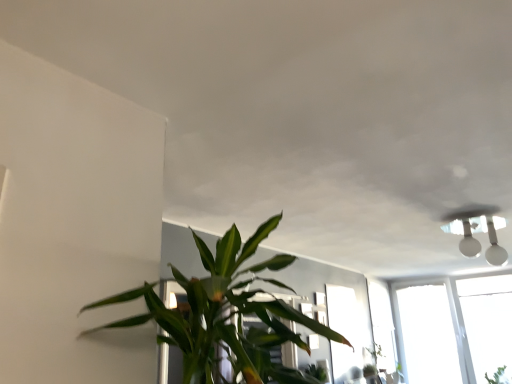
What is the approximate width of green leafy plant at center?

30.66 inches.

Where is `transparent glass window at center`? transparent glass window at center is located at coordinates (347, 335).

What do you see at coordinates (347, 335) in the screenshot? I see `transparent glass window at center` at bounding box center [347, 335].

The height and width of the screenshot is (384, 512). What are the coordinates of `green leafy plant at lower right` in the screenshot? It's located at (497, 376).

The image size is (512, 384). Identify the location of green leafy plant at center. (225, 315).

Between green leafy plant at lower right and green leafy plant at center, which one has less height?

Standing shorter between the two is green leafy plant at lower right.

Considering the sizes of green leafy plant at lower right and green leafy plant at center in the image, is green leafy plant at lower right wider or thinner than green leafy plant at center?

Considering their sizes, green leafy plant at lower right looks slimmer than green leafy plant at center.

Is green leafy plant at center surrounded by green leafy plant at lower right?

No, green leafy plant at center is not a part of green leafy plant at lower right.

Is point (501, 379) less distant than point (185, 344)?

No.

Considering the relative positions of green leafy plant at lower right and transparent glass window at center in the image provided, is green leafy plant at lower right to the left of transparent glass window at center from the viewer's perspective?

No.

Consider the image. Is green leafy plant at lower right taller or shorter than transparent glass window at center?

Clearly, green leafy plant at lower right is shorter compared to transparent glass window at center.

Are green leafy plant at lower right and transparent glass window at center beside each other?

green leafy plant at lower right and transparent glass window at center are not in contact.

Between transparent glass window at center and green leafy plant at center, which one has smaller width?

transparent glass window at center.

What's the angular difference between transparent glass window at center and green leafy plant at center's facing directions?

The facing directions of transparent glass window at center and green leafy plant at center are 91.1 degrees apart.

How far apart are transparent glass window at center and green leafy plant at center?

transparent glass window at center is 3.19 meters away from green leafy plant at center.

From a real-world perspective, is transparent glass window at center physically located above or below green leafy plant at center?

Clearly, from a real-world perspective, transparent glass window at center is below green leafy plant at center.

What's the angular difference between green leafy plant at center and transparent glass window at center's facing directions?

The angle between the facing direction of green leafy plant at center and the facing direction of transparent glass window at center is 91.1 degrees.

Does green leafy plant at center come in front of transparent glass window at center?

Yes, green leafy plant at center is closer to the camera.

Can you confirm if green leafy plant at center is smaller than transparent glass window at center?

No, green leafy plant at center is not smaller than transparent glass window at center.

Considering the points (246, 291) and (344, 316), which point is in front, point (246, 291) or point (344, 316)?

The point (246, 291) is closer to the camera.

From the image's perspective, does green leafy plant at center appear lower than green leafy plant at lower right?

No.

From a real-world perspective, is green leafy plant at center positioned above or below green leafy plant at lower right?

green leafy plant at center is above green leafy plant at lower right.

From their relative heights in the image, would you say green leafy plant at center is taller or shorter than green leafy plant at lower right?

Considering their sizes, green leafy plant at center has more height than green leafy plant at lower right.

Which of these two, green leafy plant at center or green leafy plant at lower right, is bigger?

green leafy plant at center is bigger.

How different are the orientations of transparent glass window at center and green leafy plant at lower right in degrees?

The angle between the facing direction of transparent glass window at center and the facing direction of green leafy plant at lower right is 85 degrees.

Does transparent glass window at center have a lesser height compared to green leafy plant at lower right?

No, transparent glass window at center is not shorter than green leafy plant at lower right.

Between transparent glass window at center and green leafy plant at lower right, which one has larger size?

A: green leafy plant at lower right is bigger.

Locate an element on the screen. The image size is (512, 384). window lying above the green leafy plant at lower right (from the image's perspective) is located at coordinates [347, 335].

This screenshot has width=512, height=384. Identify the location of houseplant above the green leafy plant at lower right (from a real-world perspective). (225, 315).

Find the location of `plant lying on the right of transparent glass window at center`. plant lying on the right of transparent glass window at center is located at coordinates (497, 376).

From the image, which object appears to be nearer to green leafy plant at lower right, transparent glass window at center or green leafy plant at center?

transparent glass window at center is positioned closer to the anchor green leafy plant at lower right.

Based on their spatial positions, is green leafy plant at center or transparent glass window at center further from green leafy plant at lower right?

The object further to green leafy plant at lower right is green leafy plant at center.

Looking at the image, which one is located further to transparent glass window at center, green leafy plant at lower right or green leafy plant at center?

green leafy plant at center is positioned further to the anchor transparent glass window at center.

Looking at this image, when comparing their distances from transparent glass window at center, does green leafy plant at center or green leafy plant at lower right seem further?

green leafy plant at center.

From the image, which object appears to be farther from green leafy plant at center, green leafy plant at lower right or transparent glass window at center?

green leafy plant at lower right.

Estimate the real-world distances between objects in this image. Which object is closer to green leafy plant at center, transparent glass window at center or green leafy plant at lower right?

transparent glass window at center is closer to green leafy plant at center.

Locate an element on the screen. window between green leafy plant at center and green leafy plant at lower right in the front-back direction is located at coordinates pos(347,335).